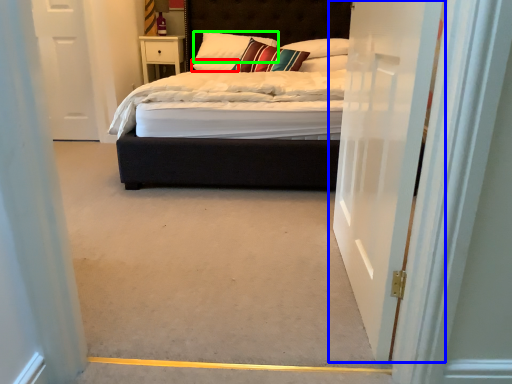
Question: Which object is positioned closest to pillow (highlighted by a red box)? Select from door (highlighted by a blue box) and pillow (highlighted by a green box).

Choices:
 (A) door
 (B) pillow

Answer: (B)